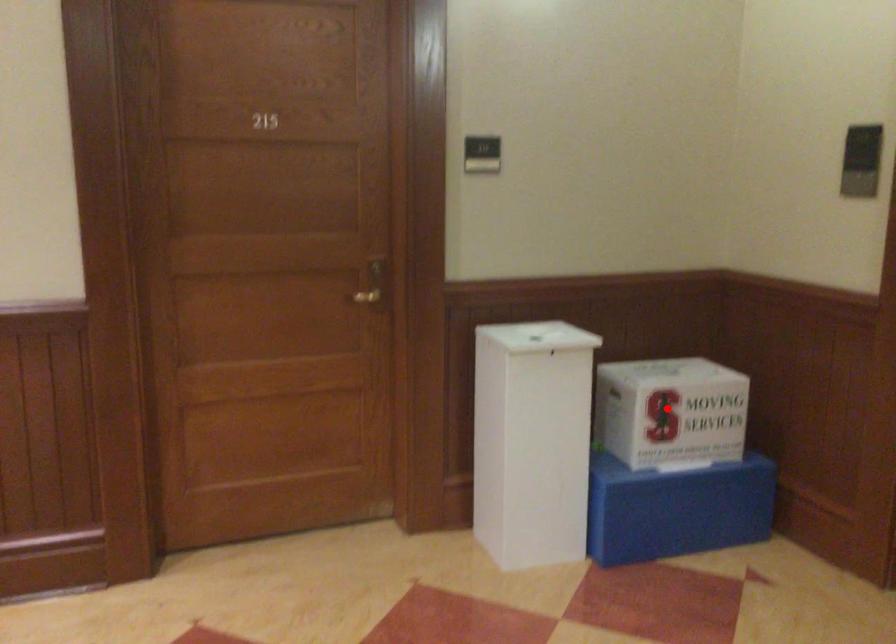
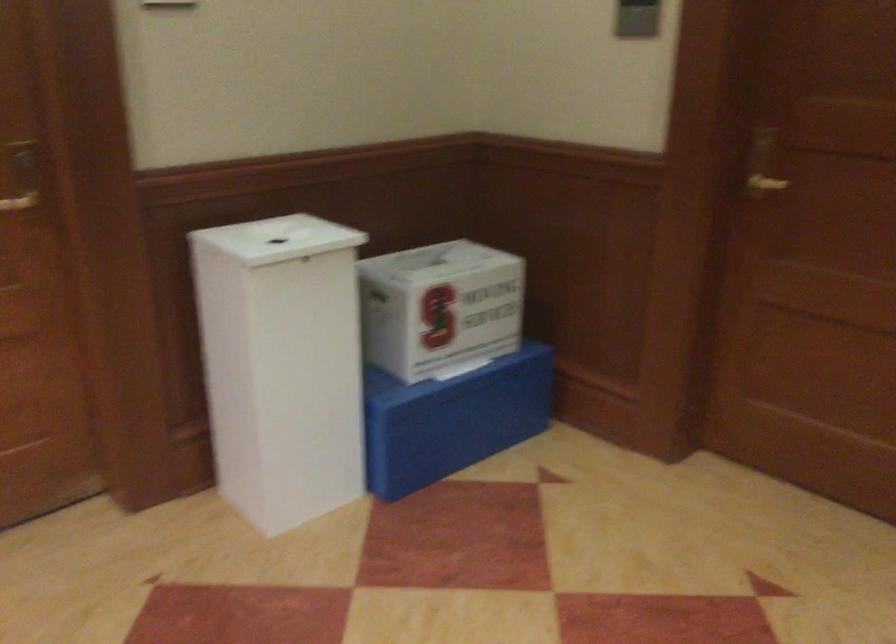
Question: I am providing you with two images of the same scene from different viewpoints. Given a red point in image1, look at the same physical point in image2. Is it:

Choices:
 (A) Closer to the viewpoint
 (B) Farther from the viewpoint

Answer: (A)